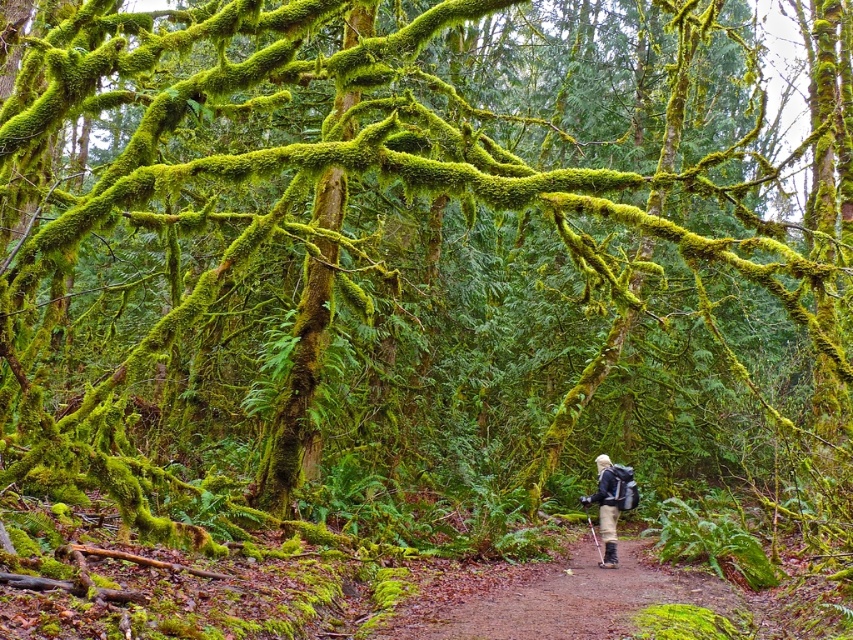
Is point (619, 600) positioned in front of point (608, 513)?

Yes, point (619, 600) is closer to viewer.

Is brown dirt path at center taller than matte black backpack at center?

No, brown dirt path at center is not taller than matte black backpack at center.

Does point (590, 600) come behind point (613, 509)?

No.

Locate an element on the screen. This screenshot has height=640, width=853. brown dirt path at center is located at coordinates (553, 596).